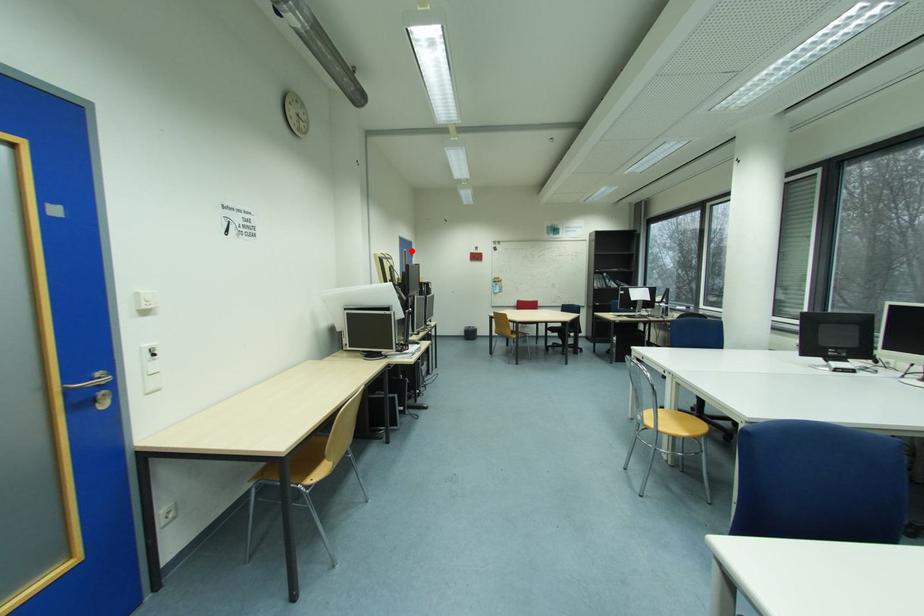
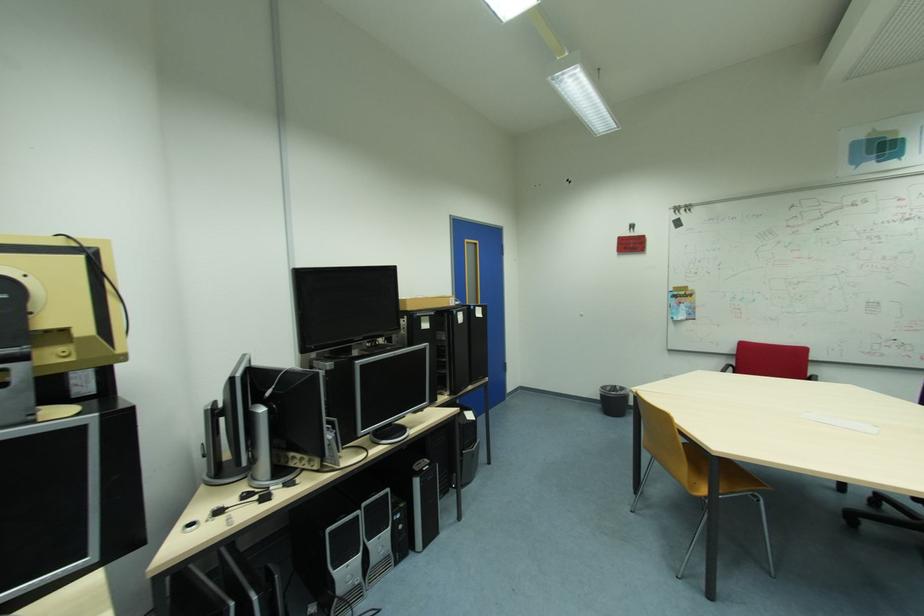
Question: I am providing you with two images of the same scene from different viewpoints. In image1, a red point is highlighted. Considering the same 3D point in image2, which of the following is correct?

Choices:
 (A) It is closer
 (B) It is farther

Answer: (B)